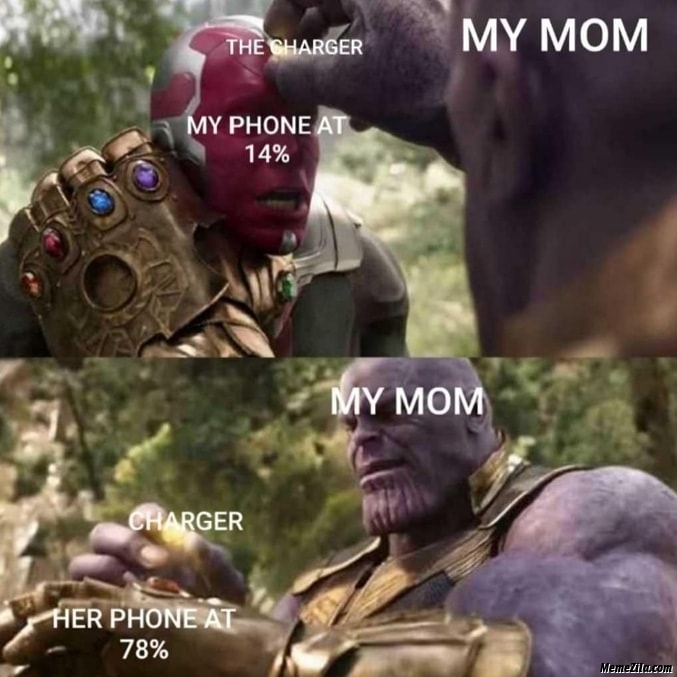
Image resolution: width=677 pixels, height=677 pixels. I want to click on gold decal, so click(328, 674), click(346, 615), click(193, 638).